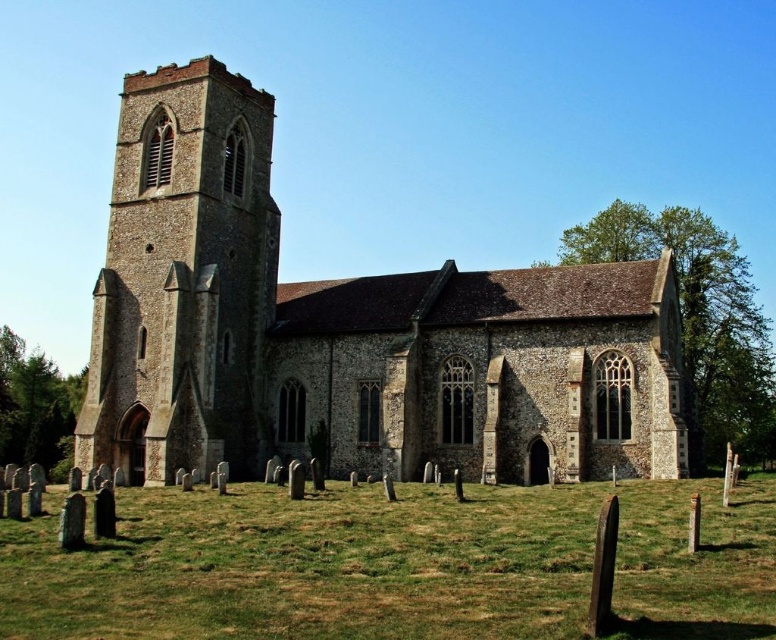
I want to click on green grass at lower center, so click(x=393, y=564).

Is point (167, 609) positioned behind point (161, 182)?

That is False.

What are the coordinates of `green grass at lower center` in the screenshot? It's located at (393, 564).

Between stone church at center and stone tower at left, which one appears on the left side from the viewer's perspective?

stone tower at left

Is stone church at center to the right of stone tower at left from the viewer's perspective?

Yes, stone church at center is to the right of stone tower at left.

The width and height of the screenshot is (776, 640). What do you see at coordinates (348, 330) in the screenshot?
I see `stone church at center` at bounding box center [348, 330].

Locate an element on the screen. This screenshot has height=640, width=776. stone church at center is located at coordinates (348, 330).

Is the position of stone church at center more distant than that of green grass at lower center?

Yes, stone church at center is further from the viewer.

Does stone church at center appear under green grass at lower center?

No, stone church at center is not below green grass at lower center.

Is point (376, 288) farther from viewer compared to point (589, 554)?

Yes, it is behind point (589, 554).

Identify the location of stone church at center. (348, 330).